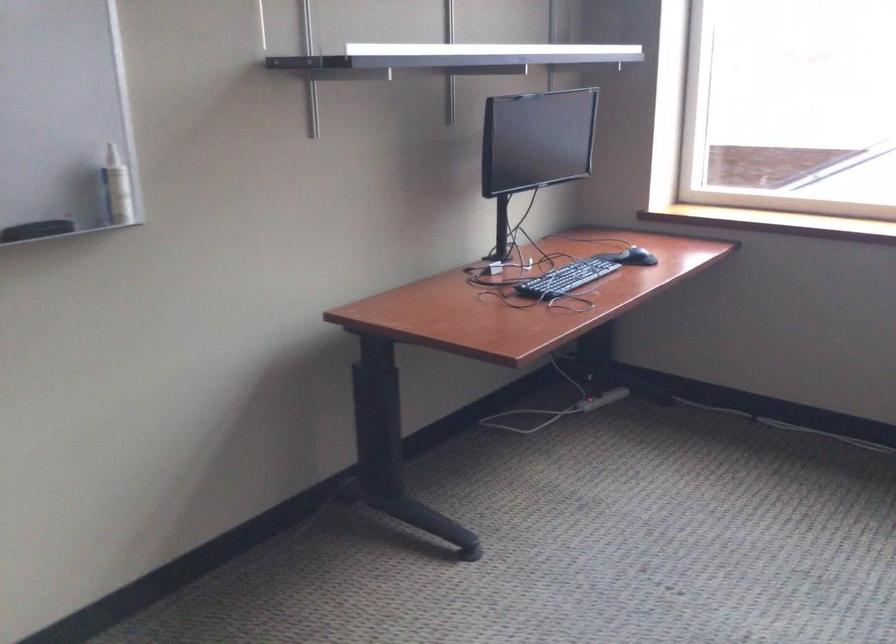
The location [117,187] corresponds to which object?

It refers to a white spray bottle.